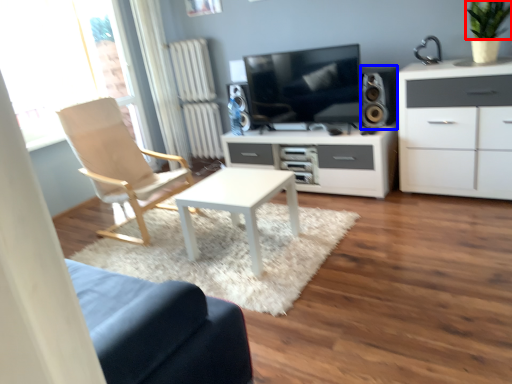
Question: Among these objects, which one is nearest to the camera, plant (highlighted by a red box) or speaker (highlighted by a blue box)?

Choices:
 (A) plant
 (B) speaker

Answer: (A)